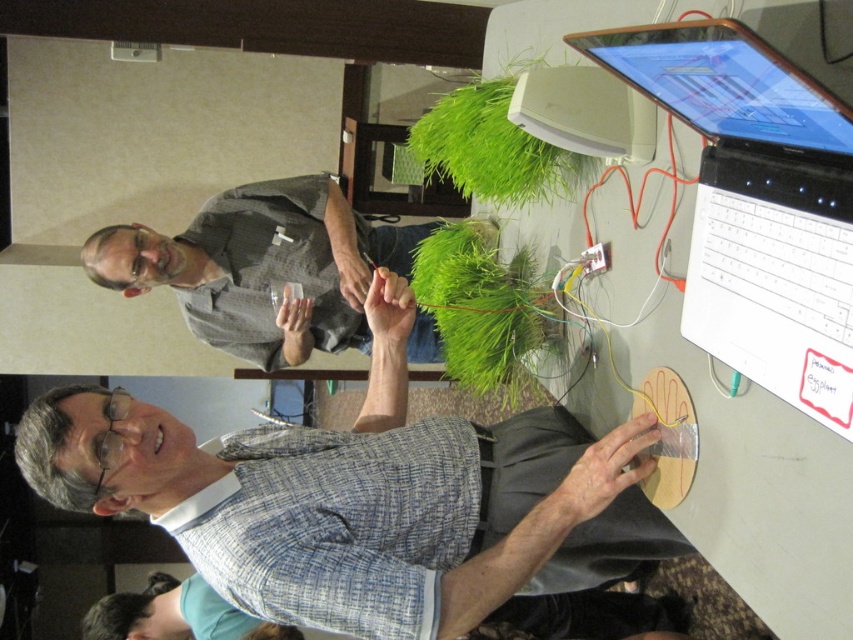
Between blue plaid shirt at center and blue plaid shirt at lower center, which one appears on the left side from the viewer's perspective?

Positioned to the left is blue plaid shirt at lower center.

Which is below, blue plaid shirt at center or blue plaid shirt at lower center?

blue plaid shirt at lower center is lower down.

You are a GUI agent. You are given a task and a screenshot of the screen. Output one action in this format:
    pyautogui.click(x=<x>, y=<y>)
    Task: Click on the blue plaid shirt at center
    This screenshot has height=640, width=853.
    Given the screenshot: What is the action you would take?
    pos(363,499)

The image size is (853, 640). Identify the location of blue plaid shirt at center. (363, 499).

Does black plastic laptop at upper right have a lesser height compared to matte black laptop at upper right?

In fact, black plastic laptop at upper right may be taller than matte black laptop at upper right.

From the picture: Which of these two, black plastic laptop at upper right or matte black laptop at upper right, stands taller?

Standing taller between the two is black plastic laptop at upper right.

Image resolution: width=853 pixels, height=640 pixels. What do you see at coordinates (756, 204) in the screenshot? I see `black plastic laptop at upper right` at bounding box center [756, 204].

This screenshot has width=853, height=640. I want to click on black plastic laptop at upper right, so click(756, 204).

Which of these two, gray fabric shirt at upper center or white plastic computer at upper center, stands shorter?

white plastic computer at upper center is shorter.

Does point (158, 268) come in front of point (625, 131)?

No, it is behind (625, 131).

Where is `gray fabric shirt at upper center`? gray fabric shirt at upper center is located at coordinates [x=262, y=268].